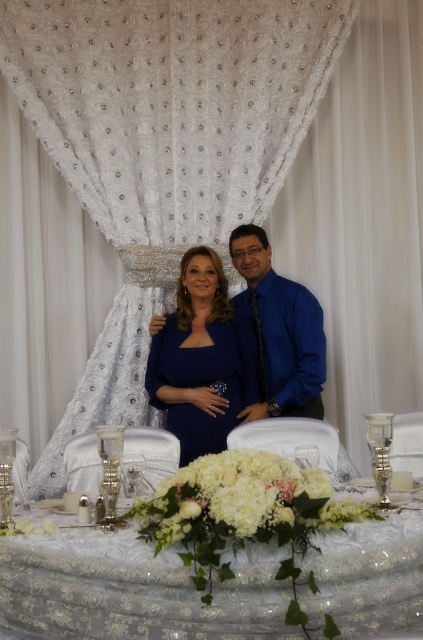
Which is in front, point (368, 589) or point (195, 420)?

Positioned in front is point (368, 589).

Is white textured tablecloth at center thinner than matte blue dress at center?

No.

Measure the distance between point (96, 541) and camera.

1.99 meters

You are a GUI agent. You are given a task and a screenshot of the screen. Output one action in this format:
    pyautogui.click(x=<x>, y=<y>)
    Task: Click on the white textured tablecloth at center
    The image size is (423, 640).
    Given the screenshot: What is the action you would take?
    pyautogui.click(x=134, y=589)

Does white textured tablecloth at center have a lesser width compared to blue satin shirt at center?

Incorrect, white textured tablecloth at center's width is not less than blue satin shirt at center's.

Which is behind, point (414, 552) or point (291, 369)?

The point (291, 369) is behind.

At what (x,y) coordinates should I click in order to perform the action: click on white textured tablecloth at center. Please return your answer as a coordinate pair (x, y). The image size is (423, 640). Looking at the image, I should click on (134, 589).

Does matte blue dress at center have a smaller size compared to blue satin shirt at center?

Yes.

Between matte blue dress at center and blue satin shirt at center, which one has less height?

Standing shorter between the two is blue satin shirt at center.

Which is in front, point (176, 321) or point (238, 298)?

Point (176, 321) is in front.

You are a GUI agent. You are given a task and a screenshot of the screen. Output one action in this format:
    pyautogui.click(x=<x>, y=<y>)
    Task: Click on the matte blue dress at center
    The height and width of the screenshot is (640, 423).
    Given the screenshot: What is the action you would take?
    pyautogui.click(x=203, y=358)